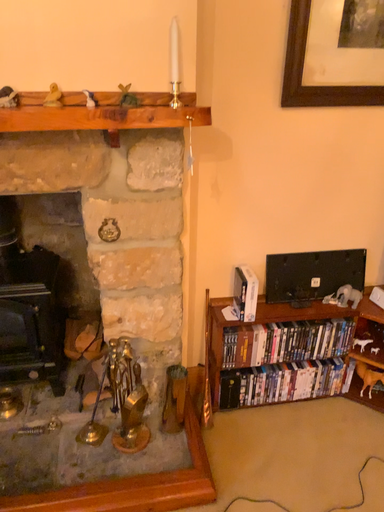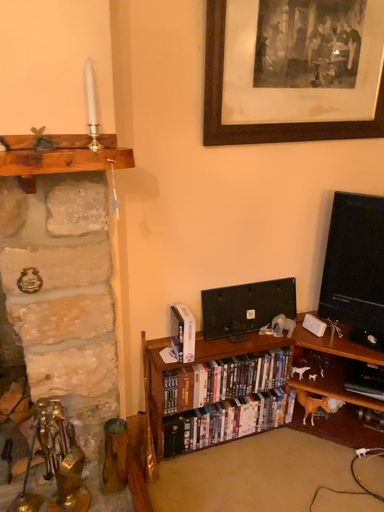
Question: How did the camera likely rotate when shooting the video?

Choices:
 (A) rotated right
 (B) rotated left

Answer: (A)